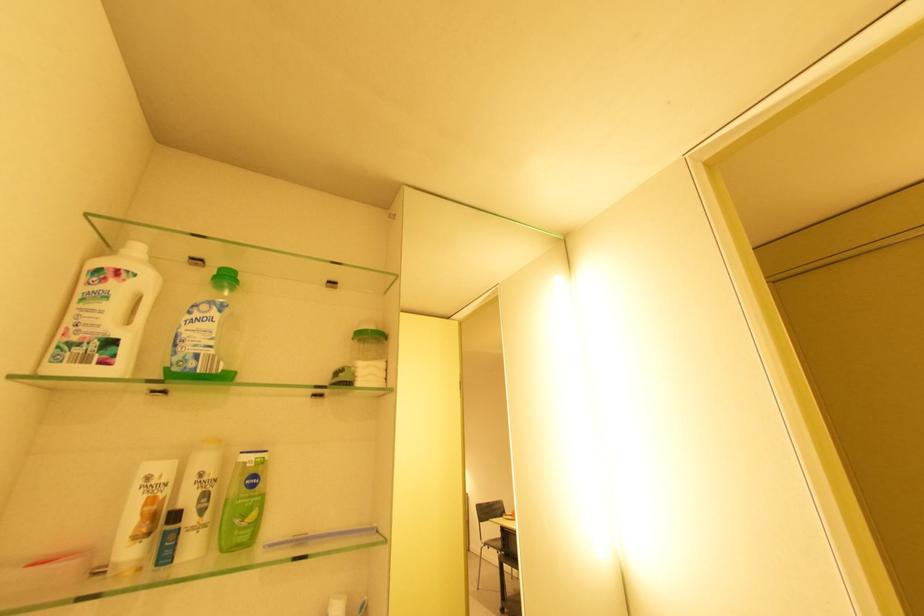
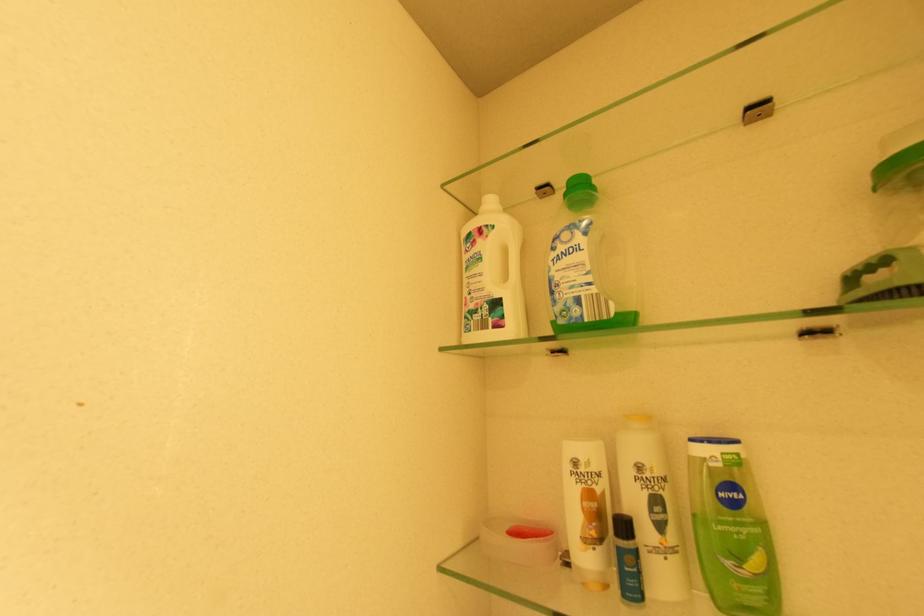
Locate, in the second image, the point that corresponds to point (220, 273) in the first image.

(569, 190)